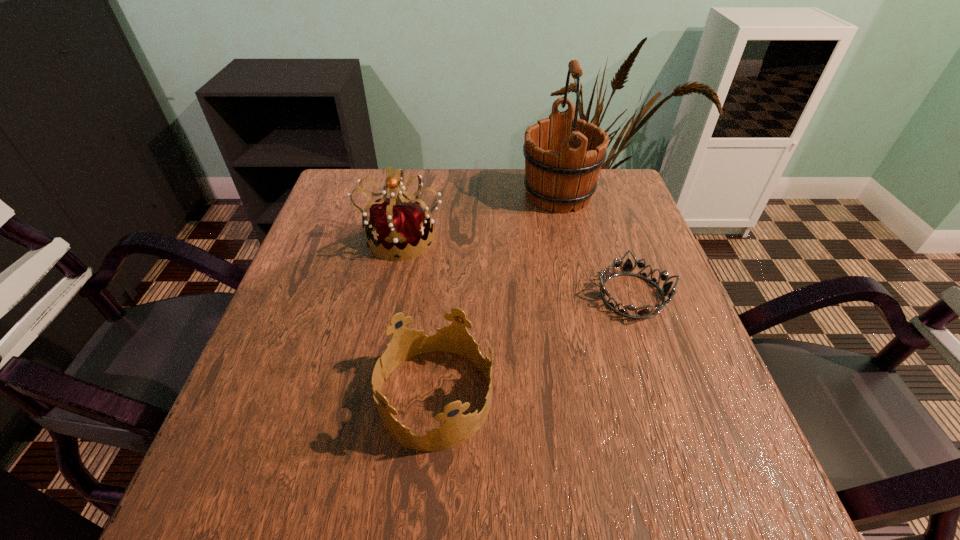
At what (x,y) coordinates should I click in order to perform the action: click on the tallest object. Please return your answer as a coordinate pair (x, y). Looking at the image, I should click on (563, 158).

I want to click on the farthest tiara, so click(x=397, y=223).

Identify the location of the tallest tiara. This screenshot has height=540, width=960. (397, 223).

In order to click on the second tallest tiara in this screenshot , I will do `click(405, 343)`.

In order to click on the nearest tiara in this screenshot , I will do `click(405, 343)`.

Identify the location of the rightmost tiara. The image size is (960, 540). (627, 268).

You are a GUI agent. You are given a task and a screenshot of the screen. Output one action in this format:
    pyautogui.click(x=<x>, y=<y>)
    Task: Click on the second nearest tiara
    
    Given the screenshot: What is the action you would take?
    pyautogui.click(x=627, y=268)

The height and width of the screenshot is (540, 960). Find the location of `vacant space located 0.290m on the front of the tallest object`. vacant space located 0.290m on the front of the tallest object is located at coordinates (583, 300).

At what (x,y) coordinates should I click in order to perform the action: click on free spot located on the front-facing side of the farthest tiara. Please return your answer as a coordinate pair (x, y). Image resolution: width=960 pixels, height=540 pixels. Looking at the image, I should click on (376, 359).

Identify the location of vacant space situated on the front-facing side of the second tallest tiara. (582, 397).